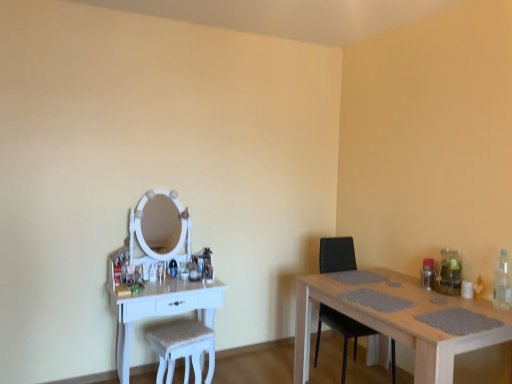
What do you see at coordinates (396, 325) in the screenshot? This screenshot has width=512, height=384. I see `light brown wooden table at right, the 1th table from the right` at bounding box center [396, 325].

Find the location of a particular element. light brown wooden table at right, the 1th table from the right is located at coordinates (396, 325).

In order to face black leather chair at right, should I rotate leftwards or rightwards?

A 13.142 degree turn to the right will do.

This screenshot has height=384, width=512. Describe the element at coordinates (341, 332) in the screenshot. I see `black leather chair at right` at that location.

Where is `white fabric swivel chair at center`? The width and height of the screenshot is (512, 384). white fabric swivel chair at center is located at coordinates (183, 349).

Measure the distance between white wood table at left, which is the 1th table in left-to-right order, and camera.

white wood table at left, which is the 1th table in left-to-right order, and camera are 8.84 feet apart from each other.

This screenshot has width=512, height=384. Identify the location of clear plastic bottle at right. (502, 283).

Is point (202, 361) behind point (508, 295)?

That is True.

Between white wood table at left, which is the 1th table in left-to-right order, and clear plastic bottle at right, which one has smaller width?

Thinner between the two is clear plastic bottle at right.

Is white wood table at left, which is the 1th table in left-to-right order, turned away from clear plastic bottle at right?

white wood table at left, which is the 1th table in left-to-right order, does not have its back to clear plastic bottle at right.

Does white wood table at left, which is the 1th table in left-to-right order, appear on the right side of clear plastic bottle at right?

Incorrect, white wood table at left, which is the 1th table in left-to-right order, is not on the right side of clear plastic bottle at right.

Find the location of a particular element. table on the left of white fabric swivel chair at center is located at coordinates (161, 309).

From the image's perspective, is white wood table at left, which is the second table in right-to-left order, located above or below white fabric swivel chair at center?

white wood table at left, which is the second table in right-to-left order, is above white fabric swivel chair at center.

What's the angular difference between white wood table at left, which is the 1th table in left-to-right order, and white fabric swivel chair at center's facing directions?

The facing directions of white wood table at left, which is the 1th table in left-to-right order, and white fabric swivel chair at center are 14.4 degrees apart.

From a real-world perspective, is white wood table at left, which is the 1th table in left-to-right order, positioned above or below white fabric swivel chair at center?

From a real-world perspective, white wood table at left, which is the 1th table in left-to-right order, is physically above white fabric swivel chair at center.

Which object is positioned more to the right, black leather chair at right or light brown wooden table at right, the 1th table from the right?

Positioned to the right is light brown wooden table at right, the 1th table from the right.

Is black leather chair at right thinner than light brown wooden table at right, the 1th table from the right?

Yes.

From a real-world perspective, is black leather chair at right above or below light brown wooden table at right, which is the second table in left-to-right order?

In terms of real-world spatial position, black leather chair at right is above light brown wooden table at right, which is the second table in left-to-right order.

Locate an element on the screen. The width and height of the screenshot is (512, 384). table lying on the right of black leather chair at right is located at coordinates (396, 325).

Are clear plastic bottle at right and white wood table at left, which is the second table in right-to-left order, located far from each other?

Yes.

Looking at this image, from a real-world perspective, which object stands above the other?

clear plastic bottle at right is physically above.

Is clear plastic bottle at right closer to camera compared to white wood table at left, which is the 1th table in left-to-right order?

Yes.

Choose the correct answer: Is clear plastic bottle at right inside white wood table at left, which is the 1th table in left-to-right order, or outside it?

The correct answer is: outside.

From the image's perspective, which table is the 1st one below the black leather chair at right? Please provide its 2D coordinates.

[(161, 309)]

Considering the relative sizes of black leather chair at right and white wood table at left, which is the second table in right-to-left order, in the image provided, is black leather chair at right wider than white wood table at left, which is the second table in right-to-left order,?

Yes, black leather chair at right is wider than white wood table at left, which is the second table in right-to-left order.

From the picture: Is black leather chair at right beside white wood table at left, which is the 1th table in left-to-right order?

black leather chair at right and white wood table at left, which is the 1th table in left-to-right order, are not in contact.

Is white wood table at left, which is the second table in right-to-left order, located within black leather chair at right?

Definitely not — white wood table at left, which is the second table in right-to-left order, is not inside black leather chair at right.

Which object is wider, clear plastic bottle at right or light brown wooden table at right, the 1th table from the right?

light brown wooden table at right, the 1th table from the right, is wider.

Are clear plastic bottle at right and light brown wooden table at right, the 1th table from the right, far apart?

No, clear plastic bottle at right is not far from light brown wooden table at right, the 1th table from the right.

From the image's perspective, who appears lower, clear plastic bottle at right or light brown wooden table at right, the 1th table from the right?

light brown wooden table at right, the 1th table from the right, from the image's perspective.

How many degrees apart are the facing directions of black leather chair at right and white fabric swivel chair at center?

black leather chair at right and white fabric swivel chair at center are facing 19.3 degrees away from each other.

Is black leather chair at right to the left of white fabric swivel chair at center from the viewer's perspective?

No, black leather chair at right is not to the left of white fabric swivel chair at center.

Between black leather chair at right and white fabric swivel chair at center, which one has larger width?

Wider between the two is black leather chair at right.

Does black leather chair at right come in front of white fabric swivel chair at center?

No, the depth of black leather chair at right is greater than that of white fabric swivel chair at center.

I want to click on table that is the 2nd object to the left of the clear plastic bottle at right, starting at the anchor, so click(161, 309).

Image resolution: width=512 pixels, height=384 pixels. Identify the location of swivel chair lying on the right of white wood table at left, which is the second table in right-to-left order. (183, 349).

From the image, which object appears to be nearer to white wood table at left, which is the second table in right-to-left order, black leather chair at right or light brown wooden table at right, the 1th table from the right?

light brown wooden table at right, the 1th table from the right, is positioned closer to the anchor white wood table at left, which is the second table in right-to-left order.

In the scene shown: From the image, which object appears to be farther from white fabric swivel chair at center, black leather chair at right or light brown wooden table at right, the 1th table from the right?

black leather chair at right lies further to white fabric swivel chair at center than the other object.

From the image, which object appears to be farther from clear plastic bottle at right, white fabric swivel chair at center or black leather chair at right?

Based on the image, white fabric swivel chair at center appears to be further to clear plastic bottle at right.

In the scene shown: Which object lies further to the anchor point white fabric swivel chair at center, black leather chair at right or clear plastic bottle at right?

clear plastic bottle at right is further to white fabric swivel chair at center.

Considering their positions, is white fabric swivel chair at center positioned closer to black leather chair at right than clear plastic bottle at right?

Among the two, white fabric swivel chair at center is located nearer to black leather chair at right.

Looking at the image, which one is located further to clear plastic bottle at right, white fabric swivel chair at center or light brown wooden table at right, which is the second table in left-to-right order?

white fabric swivel chair at center is further to clear plastic bottle at right.

Based on their spatial positions, is white wood table at left, which is the second table in right-to-left order, or light brown wooden table at right, which is the second table in left-to-right order, further from white fabric swivel chair at center?

Among the two, light brown wooden table at right, which is the second table in left-to-right order, is located further to white fabric swivel chair at center.

Considering their positions, is clear plastic bottle at right positioned closer to white fabric swivel chair at center than black leather chair at right?

black leather chair at right is closer to white fabric swivel chair at center.

Where is `table situated between white wood table at left, which is the 1th table in left-to-right order, and clear plastic bottle at right from left to right`? The height and width of the screenshot is (384, 512). table situated between white wood table at left, which is the 1th table in left-to-right order, and clear plastic bottle at right from left to right is located at coordinates (396, 325).

I want to click on chair between white wood table at left, which is the 1th table in left-to-right order, and clear plastic bottle at right from left to right, so click(x=341, y=332).

The image size is (512, 384). In order to click on chair between white fabric swivel chair at center and clear plastic bottle at right in this screenshot , I will do `click(341, 332)`.

In order to click on swivel chair between white wood table at left, which is the second table in right-to-left order, and clear plastic bottle at right, in the horizontal direction in this screenshot , I will do `click(183, 349)`.